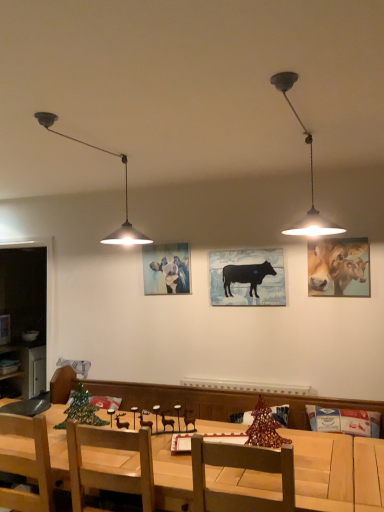
Question: Is metallic pendant light at upper right, the first lamp when ordered from right to left, wider or thinner than black wooden cow at center?

Choices:
 (A) wide
 (B) thin

Answer: (A)

Question: In the image, is metallic pendant light at upper right, the second lamp positioned from the left, positioned in front of or behind black wooden cow at center?

Choices:
 (A) behind
 (B) front

Answer: (B)

Question: Estimate the real-world distances between objects in this image. Which object is farther from the metallic silver cabinet at left?

Choices:
 (A) black wooden cow at center
 (B) metallic pendant light at upper right, the second lamp positioned from the left
 (C) wooden chair at center
 (D) pastel blue painting of cattle at center, arranged as the 2th cattle when viewed from the front
 (E) wooden table at center

Answer: (B)

Question: Based on their relative distances, which object is farther from the metallic silver cabinet at left?

Choices:
 (A) black wooden cow at center
 (B) golden glossy cattle at upper right, marked as the 2th cattle in a left-to-right arrangement
 (C) pastel blue painting of cattle at center, which ranks as the 1th cattle in left-to-right order
 (D) metallic pendant light at left, marked as the 1th lamp in a left-to-right arrangement
 (E) metallic pendant light at upper right, the second lamp positioned from the left

Answer: (E)